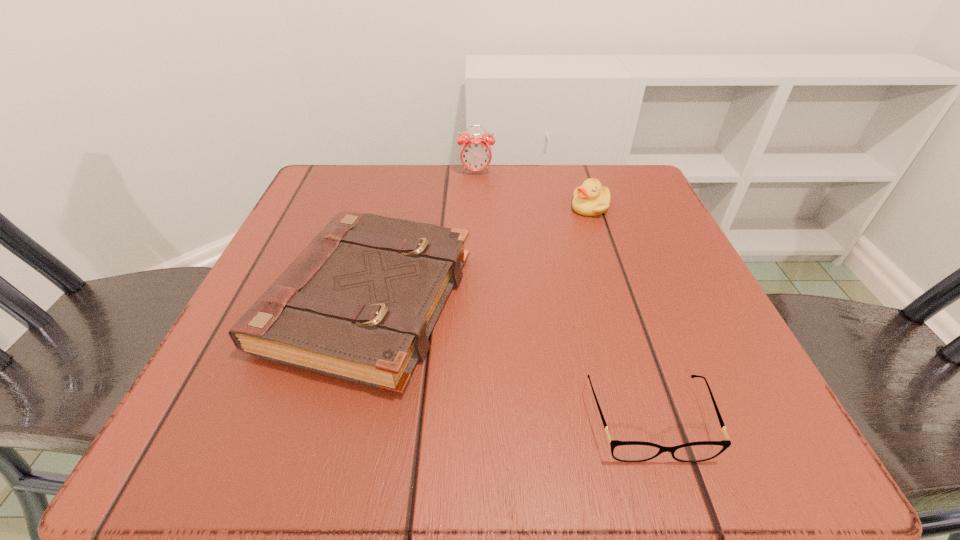
Identify the location of free spot at the far edge of the desktop. The height and width of the screenshot is (540, 960). (549, 169).

The height and width of the screenshot is (540, 960). What are the coordinates of `free space at the left edge of the desktop` in the screenshot? It's located at (261, 386).

This screenshot has height=540, width=960. Find the location of `vacant space at the right edge of the desktop`. vacant space at the right edge of the desktop is located at coordinates (667, 248).

The image size is (960, 540). I want to click on vacant space at the far left corner of the desktop, so click(x=311, y=194).

This screenshot has width=960, height=540. I want to click on free space at the far right corner, so click(650, 194).

Locate an element on the screen. free space that is in between the shortest object and the hardback book is located at coordinates (508, 361).

Image resolution: width=960 pixels, height=540 pixels. I want to click on free spot between the shortest object and the duckling, so click(x=619, y=314).

Find the location of a particular element. This screenshot has height=540, width=960. vacant space that is in between the hardback book and the spectacles is located at coordinates (508, 361).

Identify the location of vacant area that lies between the alarm clock and the spectacles. (563, 296).

What are the coordinates of `empty space between the alarm clock and the spectacles` in the screenshot? It's located at (563, 296).